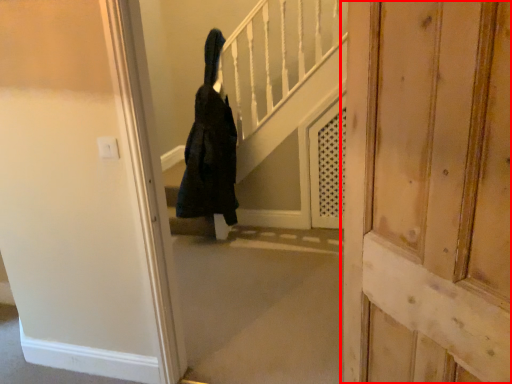
Question: From the image's perspective, considering the relative positions of door (annotated by the red box) and person in the image provided, where is door (annotated by the red box) located with respect to the staircase?

Choices:
 (A) below
 (B) above

Answer: (A)